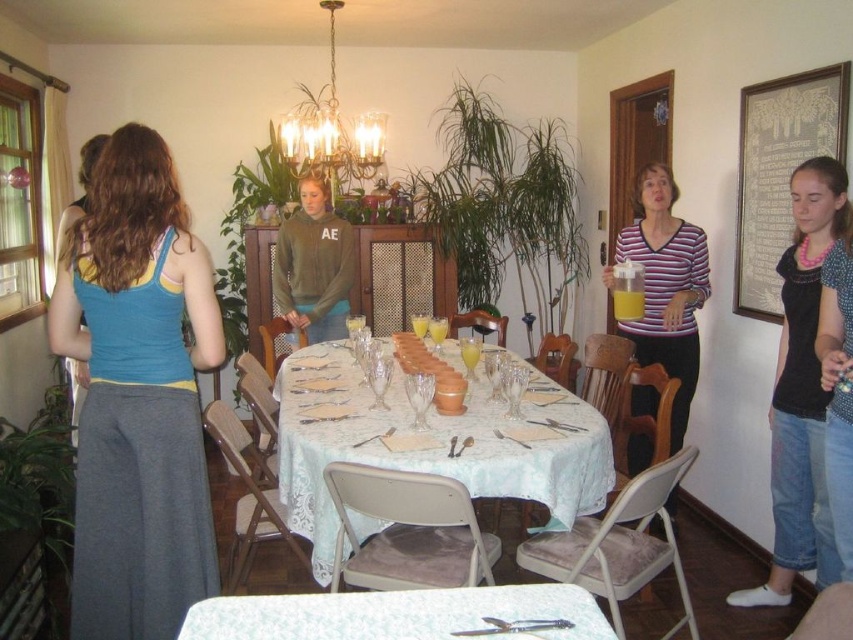
Question: Can you confirm if pink beaded necklace at upper right is smaller than white floral tablecloth at center?

Choices:
 (A) no
 (B) yes

Answer: (A)

Question: Which of these objects is positioned closest to the gold metallic chandelier at upper center?

Choices:
 (A) striped cotton shirt at center
 (B) blue fabric tank top at left

Answer: (A)

Question: Does blue fabric tank top at left appear over striped cotton shirt at center?

Choices:
 (A) no
 (B) yes

Answer: (A)

Question: Is blue fabric tank top at left to the right of white lace tablecloth at center from the viewer's perspective?

Choices:
 (A) no
 (B) yes

Answer: (A)

Question: Which object is positioned farthest from the white lace tablecloth at center?

Choices:
 (A) white floral tablecloth at center
 (B) blue fabric tank top at left

Answer: (A)

Question: Which object is farther from the camera taking this photo?

Choices:
 (A) pink beaded necklace at upper right
 (B) blue fabric tank top at left
 (C) striped cotton shirt at center
 (D) white floral tablecloth at center

Answer: (C)